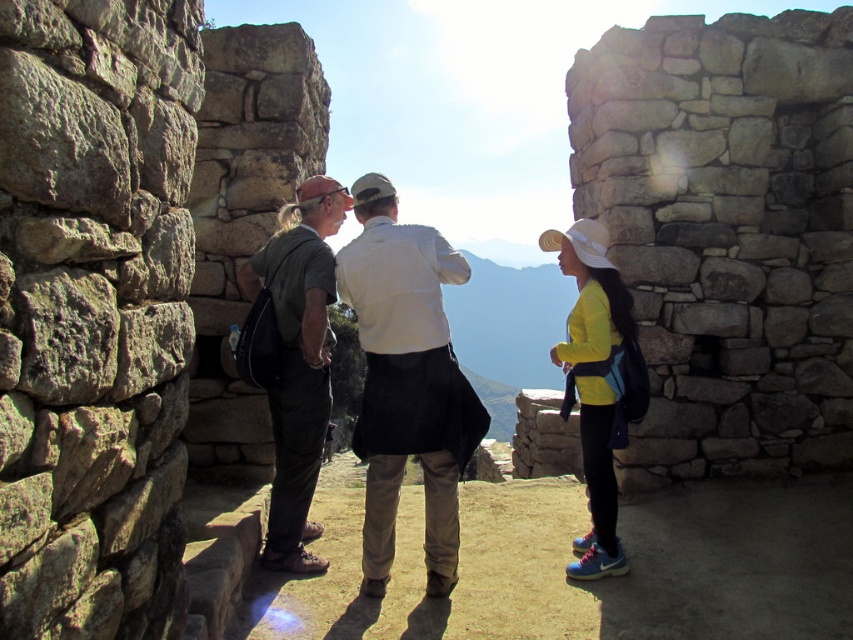
You are standing inside the ancient stone structure and want to move towards the doorway. There are two points marked on the floor, point A at coordinates point A is point [413,381] and point B at coordinates point B is point [320,448]. Which point should you step on first if you want to reach the doorway more quickly?

Point A at coordinates point A is point [413,381] is in front of point B at coordinates point B is point [320,448], so stepping on point A first would be closer to the doorway and allow you to reach it more quickly.

You are a tour guide explaining the clothing styles of visitors to this ancient site. You notice two visitors wearing shirts at the center of the structure. Which shirt is positioned lower on their body, the white matte shirt at center or the dark gray fabric shirt at center?

The white matte shirt at center is located below the dark gray fabric shirt at center, so the white matte shirt at center is positioned lower on their body.